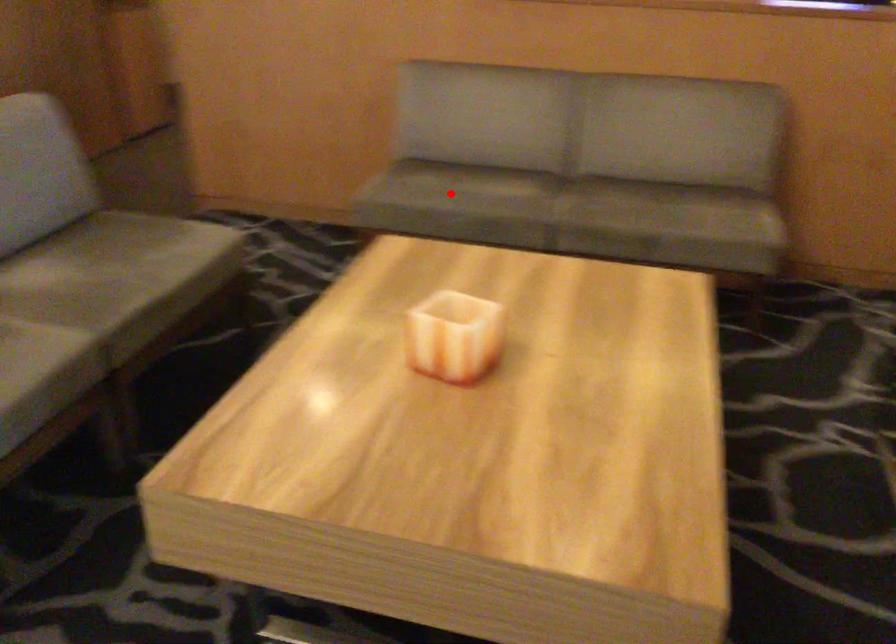
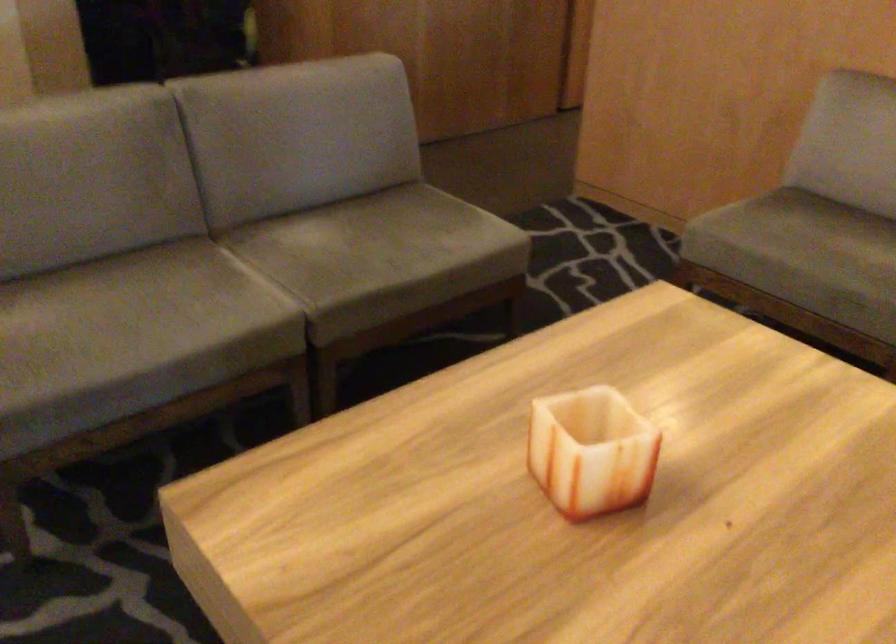
Where in the second image is the point corresponding to the highlighted location from the first image?

(798, 245)